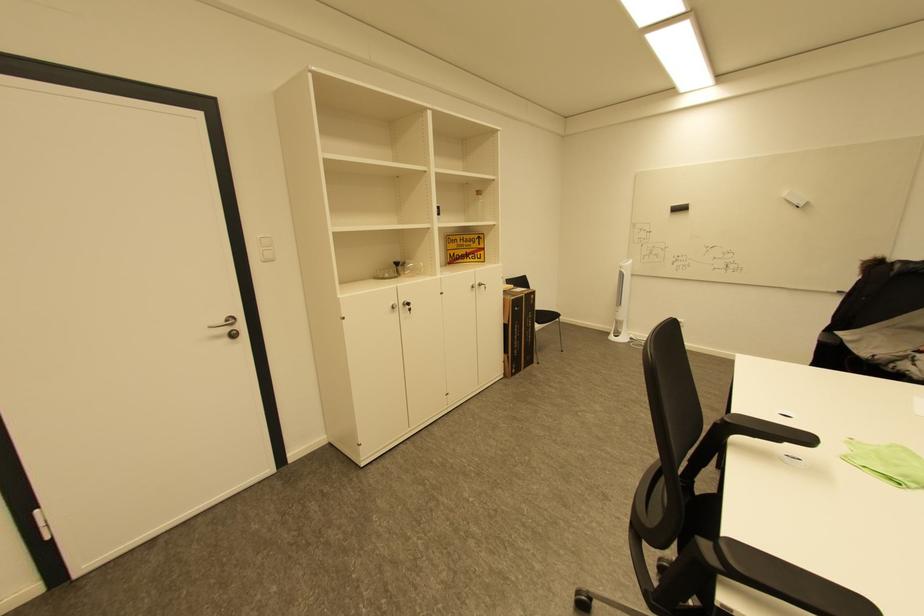
Locate an element on the screen. silver door handle is located at coordinates (227, 326).